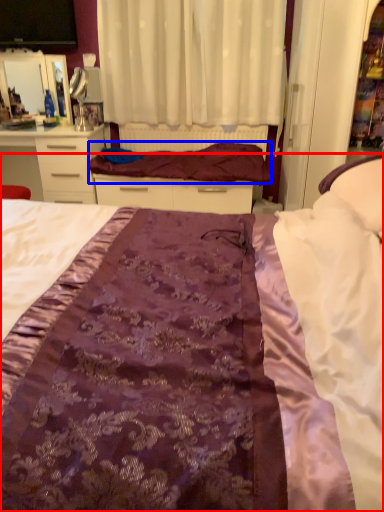
Question: Which point is closer to the camera, bed (highlighted by a red box) or blanket (highlighted by a blue box)?

Choices:
 (A) bed
 (B) blanket

Answer: (A)